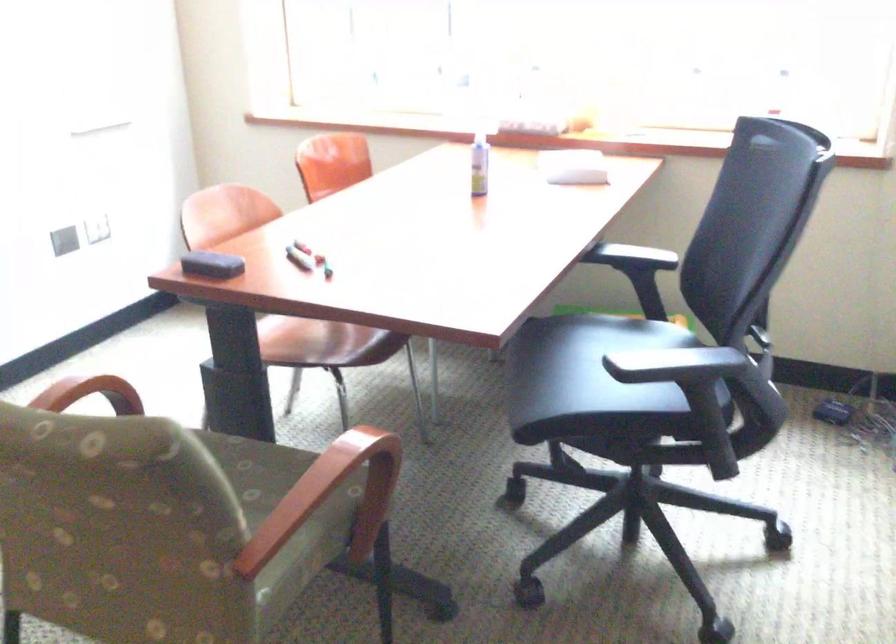
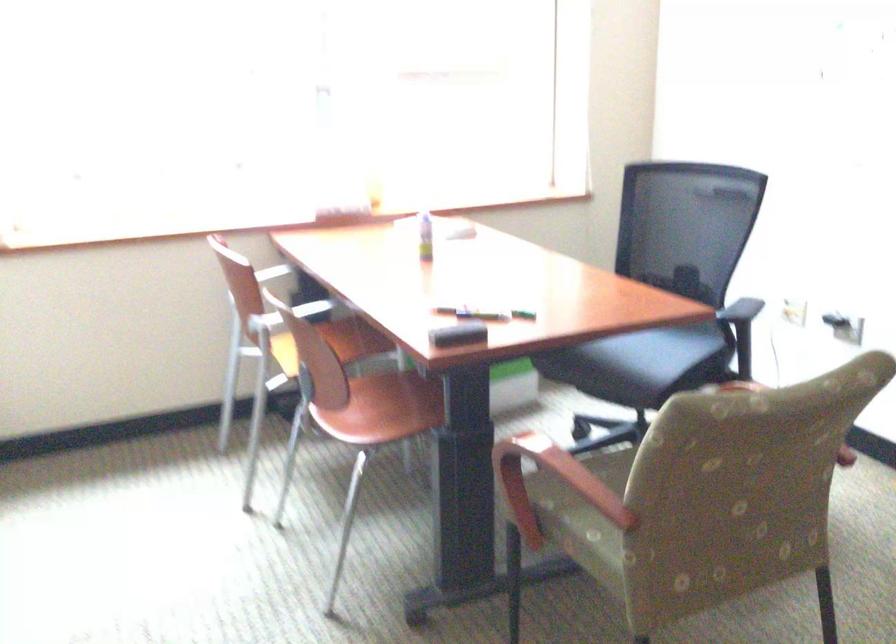
Locate, in the second image, the point that corresponds to point (591, 377) in the first image.

(649, 348)